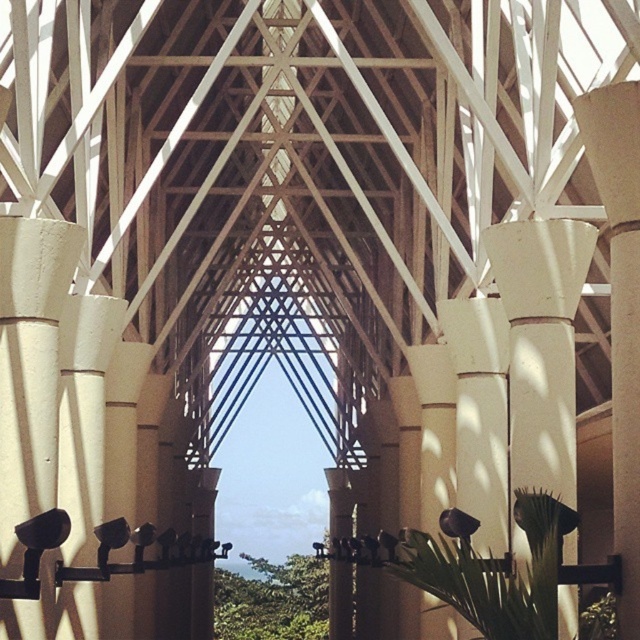
You are standing inside the architectural structure and notice a specific point marked at coordinates (541, 344). What object is located exactly at that point?

The white concrete column at center is located exactly at point (541, 344).

You are standing inside the architectural structure and want to move from the white concrete column at center to the white smooth column at right. Which direction should you move to reach it?

You should move to the right because the white smooth column at right is positioned to the right of the white concrete column at center.

You are standing inside the architectural structure and want to place a small statue on the column that is higher up. Which column should you choose between the white concrete column at center and the white smooth column at right?

You should choose the white smooth column at right because the white concrete column at center is located below it, making the white smooth column at right the higher one.